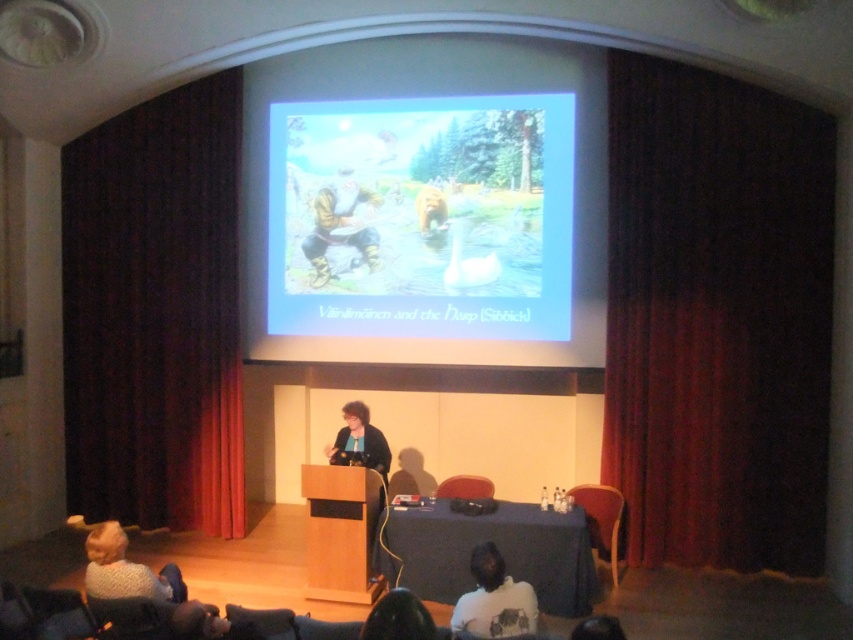
Question: Is dark red velvet curtain at left above matte digital image at center?

Choices:
 (A) no
 (B) yes

Answer: (A)

Question: In this image, where is dark velvet curtain at right located relative to beige fabric bag at center?

Choices:
 (A) above
 (B) below

Answer: (B)

Question: Where is dark velvet curtain at right located in relation to white matte shirt at lower center in the image?

Choices:
 (A) left
 (B) right

Answer: (B)

Question: Estimate the real-world distances between objects in this image. Which object is closer to the dark velvet curtain at right?

Choices:
 (A) white matte shirt at lower center
 (B) dark red velvet curtain at left
 (C) beige fabric bag at center
 (D) matte digital image at center

Answer: (D)

Question: Which of the following is the closest to the observer?

Choices:
 (A) (473, 548)
 (B) (140, 250)
 (C) (801, 294)

Answer: (A)

Question: Among these objects, which one is nearest to the camera?

Choices:
 (A) white matte shirt at lower center
 (B) dark red velvet curtain at left

Answer: (A)